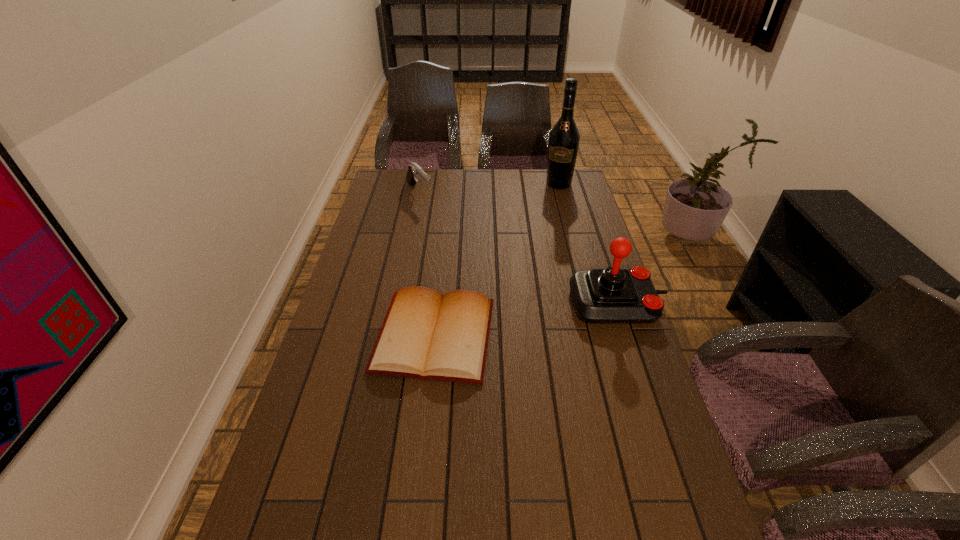
The width and height of the screenshot is (960, 540). I want to click on vacant space at the near edge of the desktop, so click(x=463, y=531).

Identify the location of vacant space at the left edge of the desktop. (315, 437).

At what (x,y) coordinates should I click in order to perform the action: click on vacant space at the right edge of the desktop. Please return your answer as a coordinate pair (x, y). Looking at the image, I should click on (579, 207).

In the image, there is a desktop. At what (x,y) coordinates should I click in order to perform the action: click on vacant space at the far left corner. Please return your answer as a coordinate pair (x, y). Looking at the image, I should click on (384, 196).

Image resolution: width=960 pixels, height=540 pixels. In order to click on free area in between the tallest object and the gun in this screenshot , I will do pos(490,188).

Find the location of `vacant region between the gun and the wine bottle`. vacant region between the gun and the wine bottle is located at coordinates (490, 188).

Locate an element on the screen. Image resolution: width=960 pixels, height=540 pixels. blank region between the tallest object and the shortest object is located at coordinates (496, 260).

You are a GUI agent. You are given a task and a screenshot of the screen. Output one action in this format:
    pyautogui.click(x=<x>, y=<y>)
    Task: Click on the vacant point located between the tallest object and the second shortest object
    The image size is (960, 540).
    Given the screenshot: What is the action you would take?
    pyautogui.click(x=490, y=188)

Locate an element on the screen. The height and width of the screenshot is (540, 960). empty location between the wine bottle and the third shortest object is located at coordinates (588, 244).

Where is `blank region between the gun and the joystick`? This screenshot has height=540, width=960. blank region between the gun and the joystick is located at coordinates (518, 248).